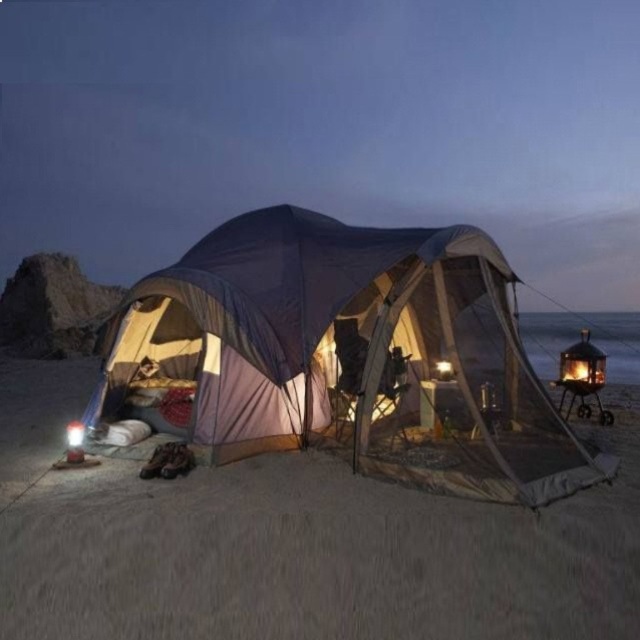
Question: Which object is farther from the camera taking this photo?

Choices:
 (A) sandy beige sand at lower center
 (B) matte purple tent at center

Answer: (A)

Question: Where is sandy beige sand at lower center located in relation to matte purple tent at center in the image?

Choices:
 (A) above
 (B) below

Answer: (B)

Question: Is sandy beige sand at lower center smaller than matte purple tent at center?

Choices:
 (A) no
 (B) yes

Answer: (B)

Question: Considering the relative positions of sandy beige sand at lower center and matte purple tent at center in the image provided, where is sandy beige sand at lower center located with respect to matte purple tent at center?

Choices:
 (A) left
 (B) right

Answer: (A)

Question: Among these objects, which one is nearest to the camera?

Choices:
 (A) sandy beige sand at lower center
 (B) matte purple tent at center

Answer: (B)